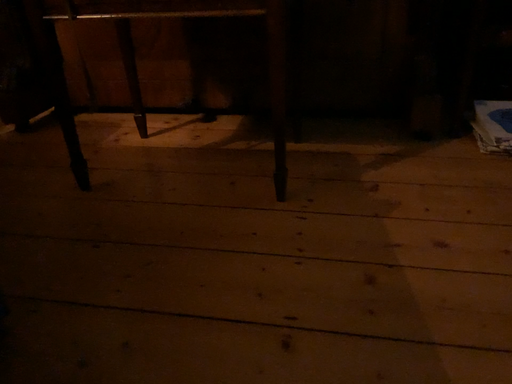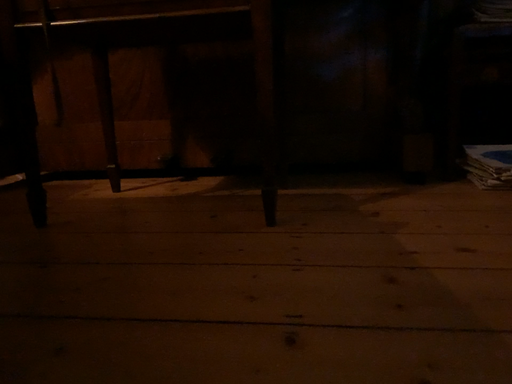
Question: How did the camera likely rotate when shooting the video?

Choices:
 (A) rotated upward
 (B) rotated downward

Answer: (A)